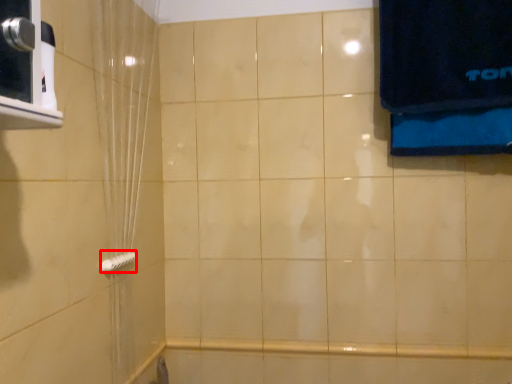
Question: From the image's perspective, considering the relative positions of towel bar (annotated by the red box) and shower curtain in the image provided, where is towel bar (annotated by the red box) located with respect to the staircase?

Choices:
 (A) below
 (B) above

Answer: (A)